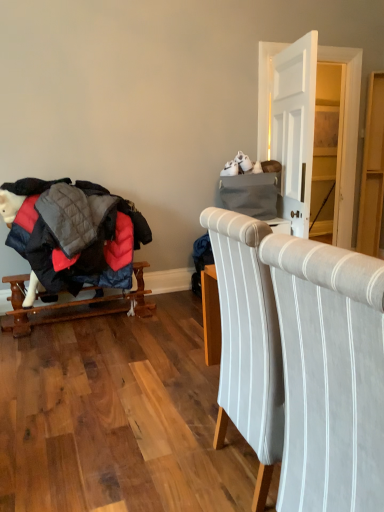
Question: From the image's perspective, is light gray striped fabric chair at center located above light wood dresser at right, the first dresser in the right-to-left sequence?

Choices:
 (A) yes
 (B) no

Answer: (B)

Question: Is light gray striped fabric chair at center smaller than light wood dresser at right, which appears as the second dresser when viewed from the left?

Choices:
 (A) yes
 (B) no

Answer: (B)

Question: From a real-world perspective, does light gray striped fabric chair at center sit lower than light wood dresser at right, the first dresser in the right-to-left sequence?

Choices:
 (A) yes
 (B) no

Answer: (A)

Question: Is light gray striped fabric chair at center outside of light wood dresser at right, the first dresser in the right-to-left sequence?

Choices:
 (A) no
 (B) yes

Answer: (B)

Question: Considering the relative positions of light gray striped fabric chair at center and light wood dresser at right, the first dresser in the right-to-left sequence, in the image provided, is light gray striped fabric chair at center behind light wood dresser at right, the first dresser in the right-to-left sequence,?

Choices:
 (A) no
 (B) yes

Answer: (A)

Question: Is light gray striped fabric chair at center at the right side of light wood dresser at right, the first dresser in the right-to-left sequence?

Choices:
 (A) no
 (B) yes

Answer: (A)

Question: From a real-world perspective, is wooden rocking horse at left on light gray striped fabric chair at center?

Choices:
 (A) yes
 (B) no

Answer: (B)

Question: Is wooden rocking horse at left outside of light gray striped fabric chair at center?

Choices:
 (A) yes
 (B) no

Answer: (A)

Question: Is wooden rocking horse at left thinner than light gray striped fabric chair at center?

Choices:
 (A) no
 (B) yes

Answer: (B)

Question: From the image's perspective, is wooden rocking horse at left located above light gray striped fabric chair at center?

Choices:
 (A) no
 (B) yes

Answer: (B)

Question: Does wooden rocking horse at left appear on the right side of light gray striped fabric chair at center?

Choices:
 (A) no
 (B) yes

Answer: (A)

Question: Are wooden rocking horse at left and light gray striped fabric chair at center located far from each other?

Choices:
 (A) yes
 (B) no

Answer: (A)

Question: Is matte gray dresser at upper right, the 2th dresser when ordered from right to left, further to the viewer compared to light gray striped fabric chair at center?

Choices:
 (A) yes
 (B) no

Answer: (A)